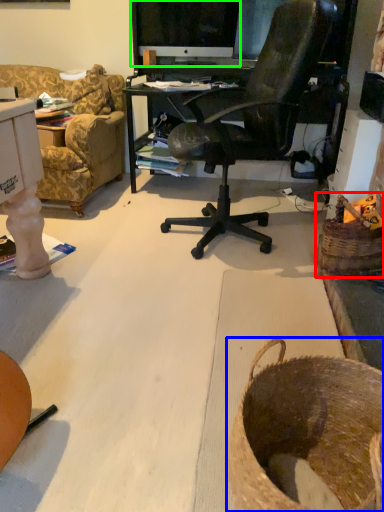
Question: Which object is the farthest from basket (highlighted by a red box)? Choose among these: basket (highlighted by a blue box) or computer monitor (highlighted by a green box).

Choices:
 (A) basket
 (B) computer monitor

Answer: (B)